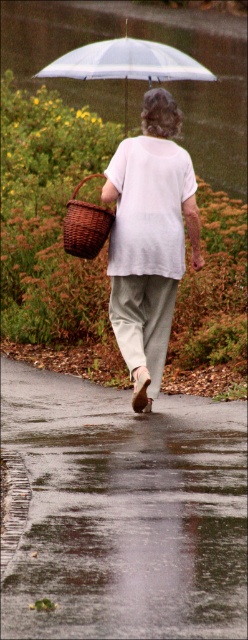
Is glossy asphalt pavement at lower center positioned in front of transparent plastic umbrella at upper center?

Yes, glossy asphalt pavement at lower center is in front of transparent plastic umbrella at upper center.

Which is below, glossy asphalt pavement at lower center or transparent plastic umbrella at upper center?

glossy asphalt pavement at lower center is below.

Find the location of `glossy asphalt pavement at lower center`. glossy asphalt pavement at lower center is located at coordinates (124, 512).

Is glossy asphalt pavement at lower center wider than brown woven basket at center?

Indeed, glossy asphalt pavement at lower center has a greater width compared to brown woven basket at center.

Between point (161, 397) and point (86, 240), which one is positioned behind?

Positioned behind is point (161, 397).

Is point (162, 550) in front of point (76, 204)?

Yes, it is in front of point (76, 204).

Where is `glossy asphalt pavement at lower center`? The height and width of the screenshot is (640, 248). glossy asphalt pavement at lower center is located at coordinates (124, 512).

Is point (203, 541) positioned before point (154, 300)?

That is True.

Measure the distance between glossy asphalt pavement at lower center and camera.

glossy asphalt pavement at lower center and camera are 21.13 feet apart from each other.

Find the location of a particular element. Image resolution: width=248 pixels, height=640 pixels. glossy asphalt pavement at lower center is located at coordinates (124, 512).